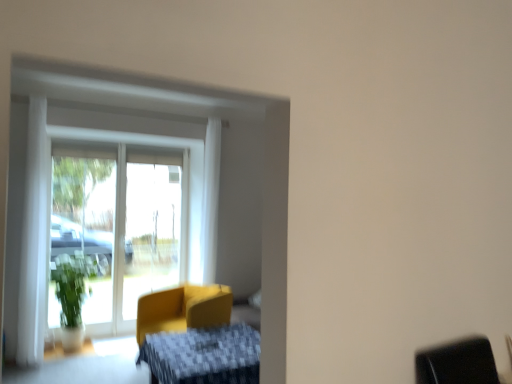
Question: From the image's perspective, does textured yellow armchair at center appear higher than matte yellow armchair at center?

Choices:
 (A) no
 (B) yes

Answer: (A)

Question: Does textured yellow armchair at center have a lesser height compared to matte yellow armchair at center?

Choices:
 (A) yes
 (B) no

Answer: (A)

Question: From a real-world perspective, does textured yellow armchair at center stand above matte yellow armchair at center?

Choices:
 (A) yes
 (B) no

Answer: (B)

Question: From the image's perspective, does textured yellow armchair at center appear lower than matte yellow armchair at center?

Choices:
 (A) no
 (B) yes

Answer: (B)

Question: Is textured yellow armchair at center in contact with matte yellow armchair at center?

Choices:
 (A) yes
 (B) no

Answer: (B)

Question: Would you say textured yellow armchair at center is outside matte yellow armchair at center?

Choices:
 (A) no
 (B) yes

Answer: (B)

Question: From the image's perspective, is matte yellow armchair at center located above textured yellow armchair at center?

Choices:
 (A) yes
 (B) no

Answer: (A)

Question: Is matte yellow armchair at center looking in the opposite direction of textured yellow armchair at center?

Choices:
 (A) yes
 (B) no

Answer: (B)

Question: Is matte yellow armchair at center to the left of textured yellow armchair at center from the viewer's perspective?

Choices:
 (A) yes
 (B) no

Answer: (A)

Question: Does matte yellow armchair at center have a smaller size compared to textured yellow armchair at center?

Choices:
 (A) yes
 (B) no

Answer: (B)

Question: Is matte yellow armchair at center thinner than textured yellow armchair at center?

Choices:
 (A) no
 (B) yes

Answer: (B)

Question: From a real-world perspective, is matte yellow armchair at center positioned under textured yellow armchair at center based on gravity?

Choices:
 (A) yes
 (B) no

Answer: (B)

Question: Considering the positions of textured yellow armchair at center and matte yellow armchair at center in the image, is textured yellow armchair at center bigger or smaller than matte yellow armchair at center?

Choices:
 (A) big
 (B) small

Answer: (B)